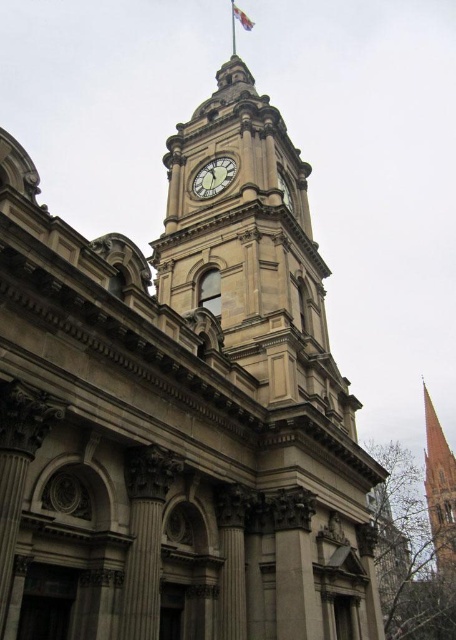
You are standing in front of the historic building and want to take a photo of both the smooth stone spire at right and the white fabric flag at upper center. Which object should you focus on first to ensure both are in clear view?

You should focus on the smooth stone spire at right first since it is closer to the viewer, ensuring both it and the white fabric flag at upper center will be in clear view when properly focused.

You are an architect inspecting the building. You need to determine which object, the smooth stone spire at right or the gold textured clock at center, requires more material for restoration. Based on their sizes, which one would need more resources?

The smooth stone spire at right is larger in size than the gold textured clock at center, so it would require more material for restoration.

You are a photographer trying to capture the clock tower. You notice the gold textured clock at center and the white fabric flag at upper center. Which object appears narrower in the photo?

The gold textured clock at center appears narrower than the white fabric flag at upper center in the photo.